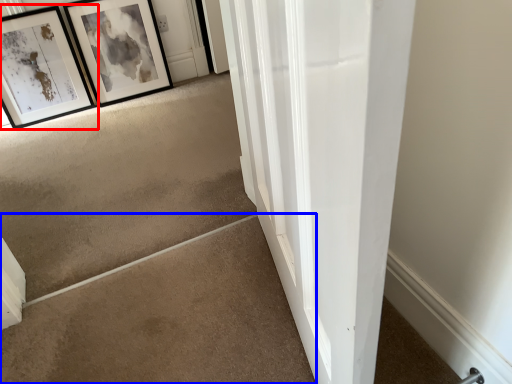
Question: Which object appears farthest to the camera in this image, picture frame (highlighted by a red box) or concrete (highlighted by a blue box)?

Choices:
 (A) picture frame
 (B) concrete

Answer: (A)